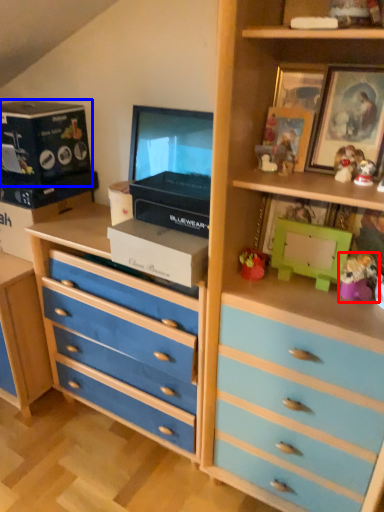
Question: Which object appears closest to the camera in this image, toy (highlighted by a red box) or box (highlighted by a blue box)?

Choices:
 (A) toy
 (B) box

Answer: (A)